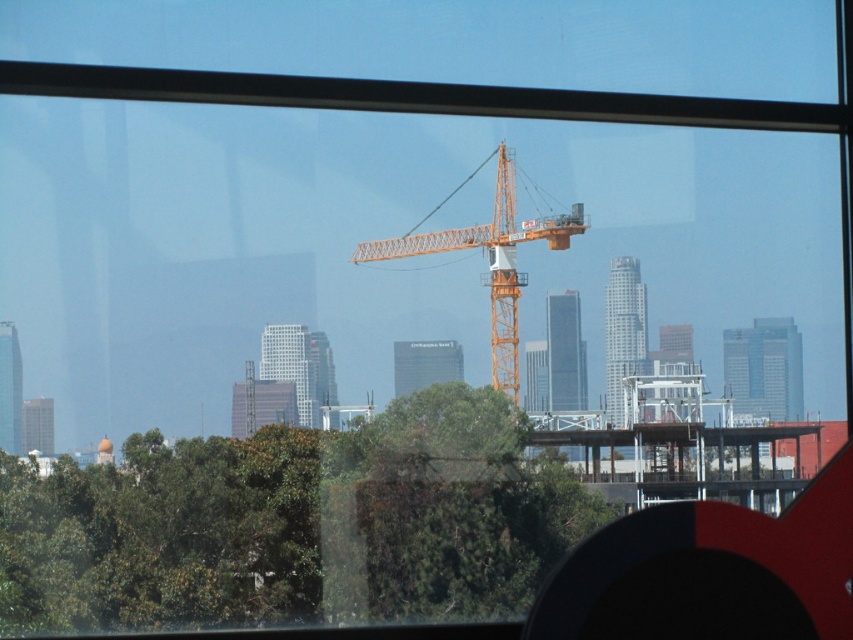
You are a city planner reviewing this area. You need to determine if the green leafy tree at center will block the view of the orange metallic crane at center from the main road. Based on their positions, what do you conclude?

The green leafy tree at center is in front of the orange metallic crane at center, so it will block the view of the crane from the main road.

You are a city planner evaluating the construction site. You need to determine if the green leafy tree at center can be preserved without obstructing the orange metallic crane at center during its operation. Based on their heights, what should you recommend?

The green leafy tree at center is not as tall as the orange metallic crane at center, so the tree is shorter and less likely to obstruct the crane during operation. It can likely be preserved without issues.